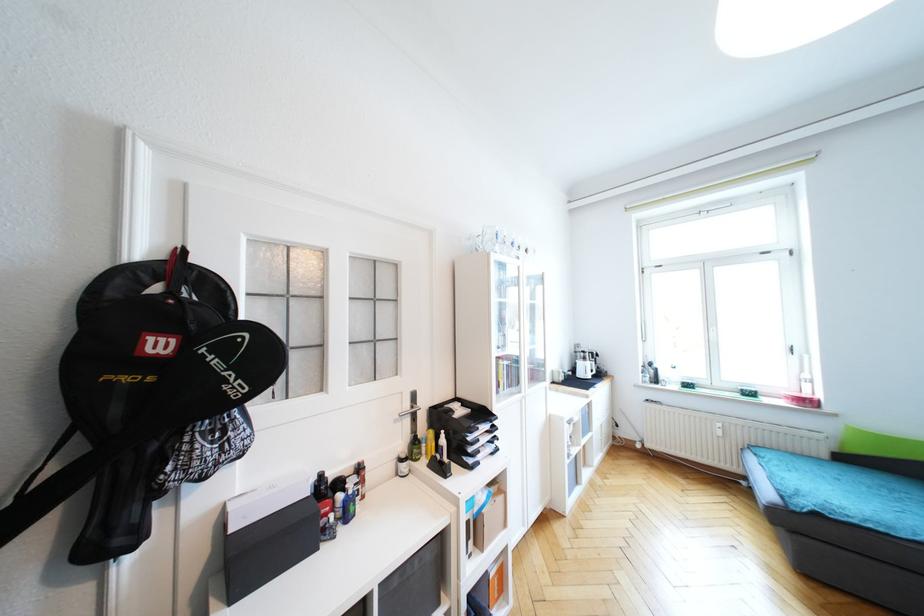
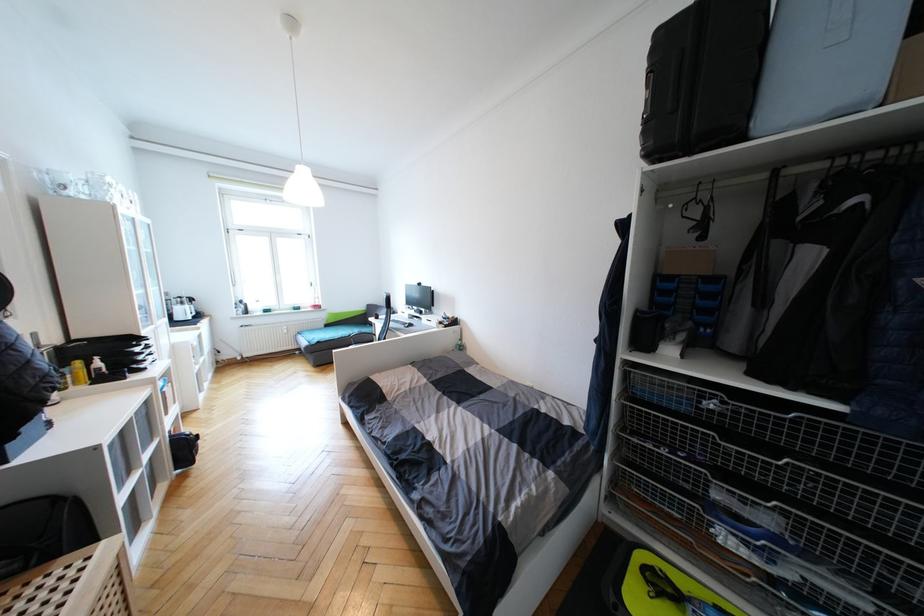
Locate, in the second image, the point that corresponds to the point at 434,435 in the first image.

(81, 363)